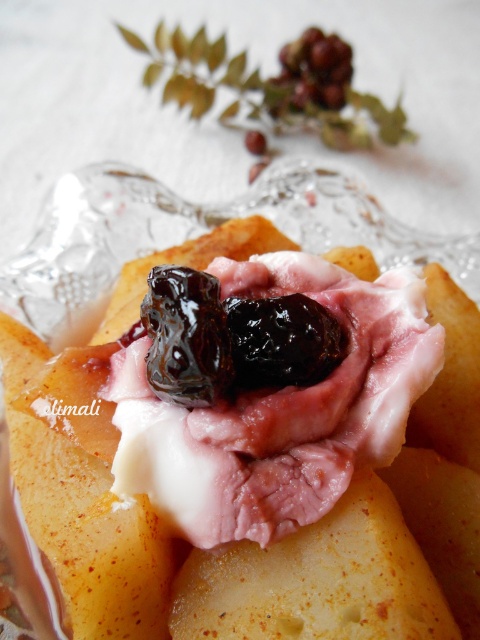
Which is in front, point (253, 308) or point (267, 81)?

Point (253, 308) is more forward.

Which of these two, pink creamy ham at center or ripe purple grapes at upper center, stands shorter?

Standing shorter between the two is ripe purple grapes at upper center.

You are a GUI agent. You are given a task and a screenshot of the screen. Output one action in this format:
    pyautogui.click(x=<x>, y=<y>)
    Task: Click on the pink creamy ham at center
    The image size is (480, 640).
    Given the screenshot: What is the action you would take?
    pyautogui.click(x=256, y=448)

Is pink creamy ham at center behind dark glossy plum at center?

That is False.

At what (x,y) coordinates should I click in order to perform the action: click on pink creamy ham at center. Please return your answer as a coordinate pair (x, y). This screenshot has height=640, width=480. Looking at the image, I should click on (256, 448).

Is dark glossy plum at center to the left of ripe purple grapes at upper center from the viewer's perspective?

Correct, you'll find dark glossy plum at center to the left of ripe purple grapes at upper center.

Does dark glossy plum at center appear under ripe purple grapes at upper center?

Correct, dark glossy plum at center is located below ripe purple grapes at upper center.

You are a GUI agent. You are given a task and a screenshot of the screen. Output one action in this format:
    pyautogui.click(x=<x>, y=<y>)
    Task: Click on the dark glossy plum at center
    This screenshot has width=480, height=640.
    Given the screenshot: What is the action you would take?
    pyautogui.click(x=282, y=340)